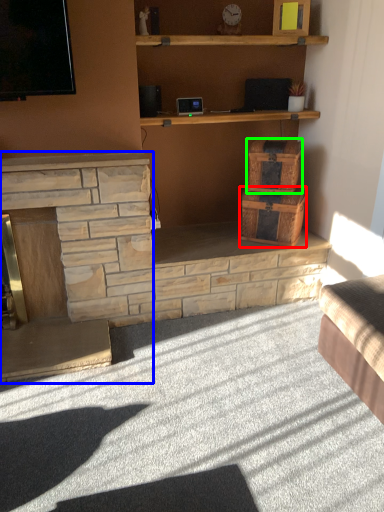
Question: Which object is the closest to the drawer (highlighted by a red box)? Choose among these: fireplace (highlighted by a blue box) or crate (highlighted by a green box).

Choices:
 (A) fireplace
 (B) crate

Answer: (B)